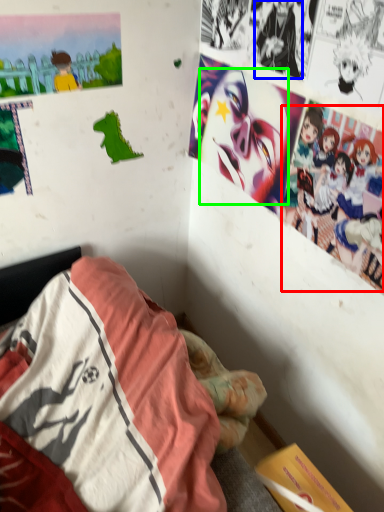
Question: Considering the real-world distances, which object is closest to person (highlighted by a red box)? person (highlighted by a blue box) or human face (highlighted by a green box).

Choices:
 (A) person
 (B) human face

Answer: (B)